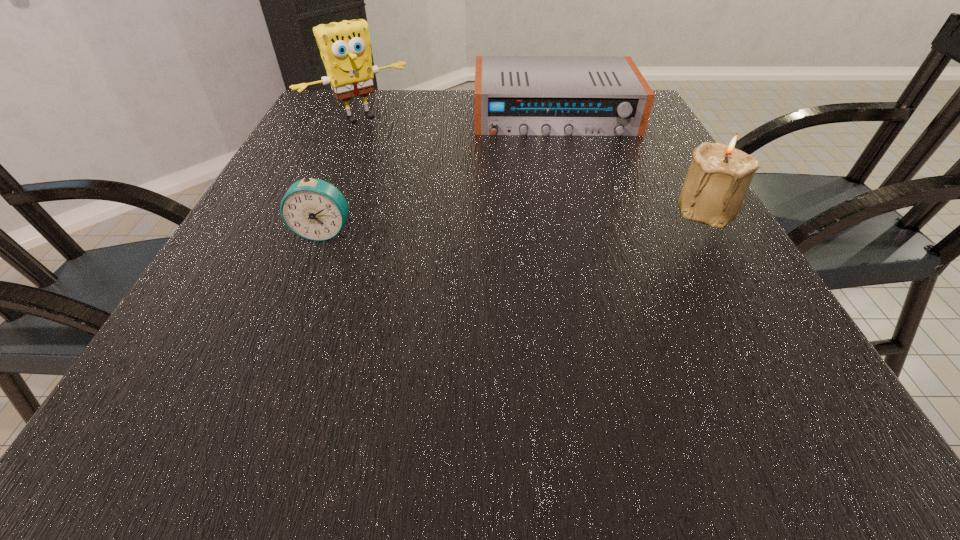
In order to click on alarm clock in this screenshot , I will do `click(314, 209)`.

Where is `the third shortest object`? the third shortest object is located at coordinates (713, 193).

You are a GUI agent. You are given a task and a screenshot of the screen. Output one action in this format:
    pyautogui.click(x=<x>, y=<y>)
    Task: Click on the tallest object
    The height and width of the screenshot is (540, 960).
    Given the screenshot: What is the action you would take?
    pyautogui.click(x=345, y=49)

At what (x,y) coordinates should I click in order to perform the action: click on the shortest object. Please return your answer as a coordinate pair (x, y). Looking at the image, I should click on click(514, 95).

Where is `free location located 0.250m on the front-facing side of the alarm clock`? This screenshot has height=540, width=960. free location located 0.250m on the front-facing side of the alarm clock is located at coordinates (275, 359).

Find the location of a particular element. The width and height of the screenshot is (960, 540). vacant space situated on the back of the third shortest object is located at coordinates (659, 126).

This screenshot has height=540, width=960. What are the coordinates of `vacant region located 0.080m on the face of the tallest object` in the screenshot? It's located at (396, 144).

Locate an element on the screen. This screenshot has width=960, height=540. free space located 0.250m on the face of the tallest object is located at coordinates (429, 176).

Find the location of `blank area located on the face of the tallest object`. blank area located on the face of the tallest object is located at coordinates point(417,164).

At what (x,y) coordinates should I click in order to perform the action: click on blank area located on the front panel of the shortest object. Please return your answer as a coordinate pair (x, y). The width and height of the screenshot is (960, 540). Looking at the image, I should click on (571, 186).